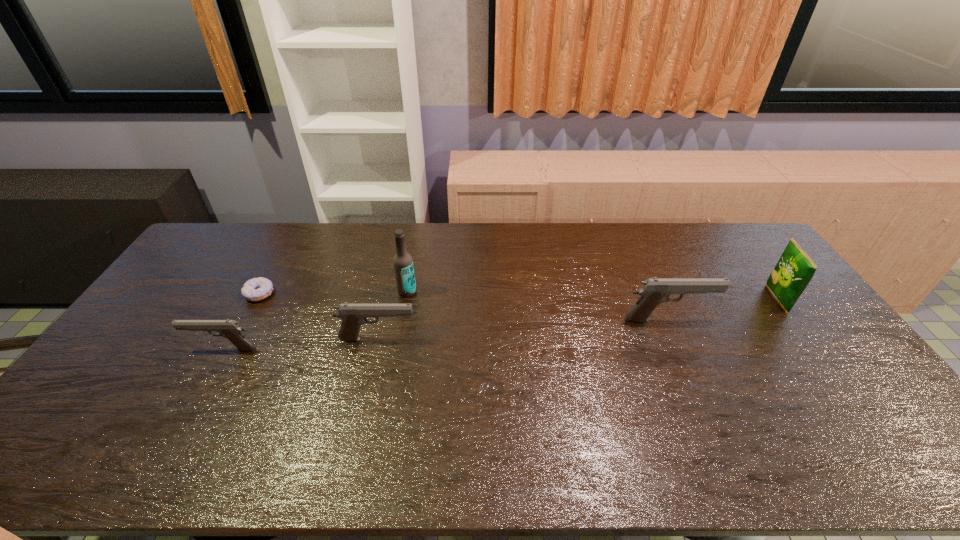
Find the location of a particular element. vacant area at the left edge of the desktop is located at coordinates (174, 338).

In the image, there is a desktop. Where is `vacant space at the near left corner`? vacant space at the near left corner is located at coordinates (135, 408).

Image resolution: width=960 pixels, height=540 pixels. I want to click on vacant area at the far right corner, so click(x=740, y=228).

At what (x,y) coordinates should I click in order to perform the action: click on vacant space in between the fourth farthest object and the tallest object. Please return your answer as a coordinate pair (x, y). Looking at the image, I should click on (538, 306).

I want to click on unoccupied position between the leftmost pistol and the third shortest object, so click(x=300, y=344).

Find the location of a particular element. The image size is (960, 540). vacant area between the shortest object and the rightmost object is located at coordinates (518, 296).

This screenshot has width=960, height=540. I want to click on free area in between the farthest pistol and the doughnut, so click(x=464, y=307).

You are a GUI agent. You are given a task and a screenshot of the screen. Output one action in this format:
    pyautogui.click(x=<x>, y=<y>)
    Task: Click on the vacant area that lies between the nearest pistol and the second nearest object
    
    Given the screenshot: What is the action you would take?
    pyautogui.click(x=300, y=344)

Find the location of a particular element. vacant space in between the third nearest object and the shortest pistol is located at coordinates (445, 334).

Identify the location of vacant region between the second object from right to left and the second tallest pistol. This screenshot has height=540, width=960. pyautogui.click(x=522, y=329).